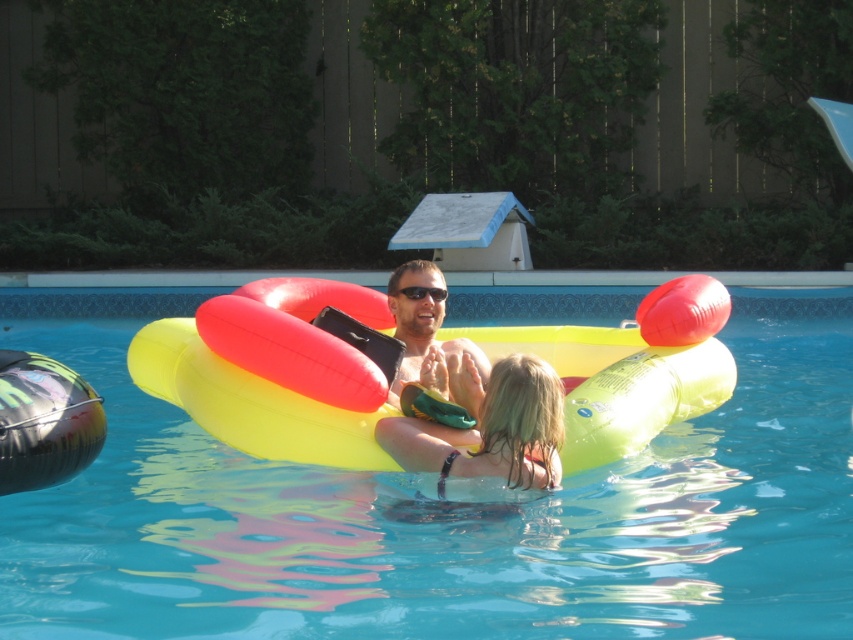
You are a photographer trying to capture the perfect shot of the man and the girl on the yellow inflatable float. You notice a point at coordinate (491,432). What is located at that point?

At point (491,432) lies shiny blonde hair at center.

You are a swimmer who wants to know if the yellow rubber ring at center can fully cover the shiny blonde hair at center. Based on the scene description, can it?

The yellow rubber ring at center has a larger width than the shiny blonde hair at center, so it can fully cover the shiny blonde hair at center.